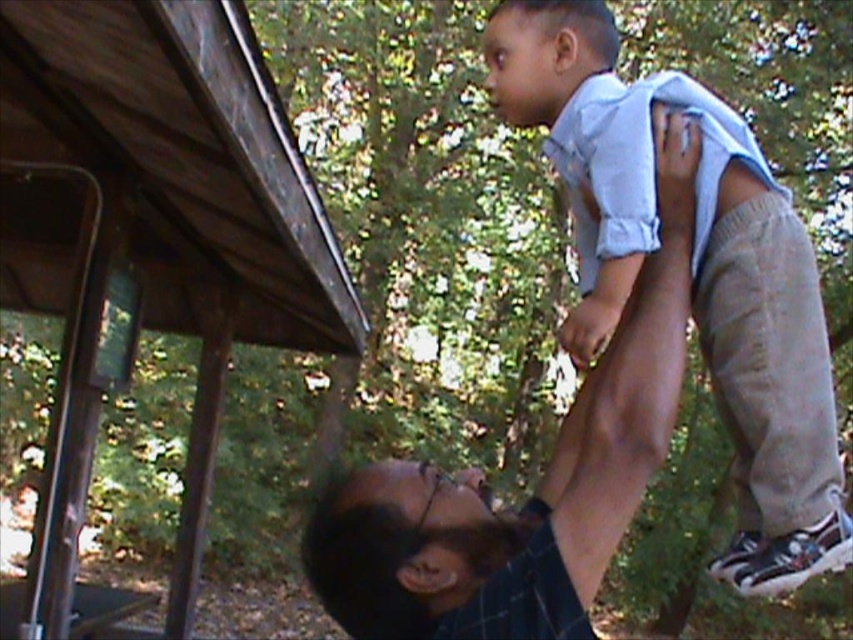
You are standing in the wooded area and want to approach the light blue shirt at upper right and the dark brown hair at upper center. Which one should you move toward first to reach the closer object?

You should move toward the light blue shirt at upper right first because it is closer to you than the dark brown hair at upper center.

You are standing at the wooden structure in the scene. There are two points marked in the image. Which point, point (732, 582) or point (532, 598), is located behind the other?

Point (732, 582) is behind point (532, 598).